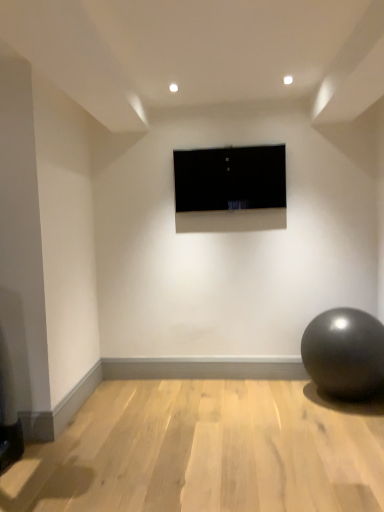
Question: From a real-world perspective, is shiny metallic ball at lower right positioned above or below black glossy tv at center?

Choices:
 (A) above
 (B) below

Answer: (B)

Question: From the image's perspective, is shiny metallic ball at lower right above or below black glossy tv at center?

Choices:
 (A) above
 (B) below

Answer: (B)

Question: Based on their sizes in the image, would you say shiny metallic ball at lower right is bigger or smaller than black glossy tv at center?

Choices:
 (A) big
 (B) small

Answer: (A)

Question: Would you say black glossy tv at center is inside or outside shiny metallic ball at lower right?

Choices:
 (A) outside
 (B) inside

Answer: (A)

Question: Based on their sizes in the image, would you say black glossy tv at center is bigger or smaller than shiny metallic ball at lower right?

Choices:
 (A) small
 (B) big

Answer: (A)

Question: Is black glossy tv at center in front of or behind shiny metallic ball at lower right in the image?

Choices:
 (A) behind
 (B) front

Answer: (A)

Question: Is point (281, 158) positioned closer to the camera than point (324, 372)?

Choices:
 (A) closer
 (B) farther

Answer: (B)